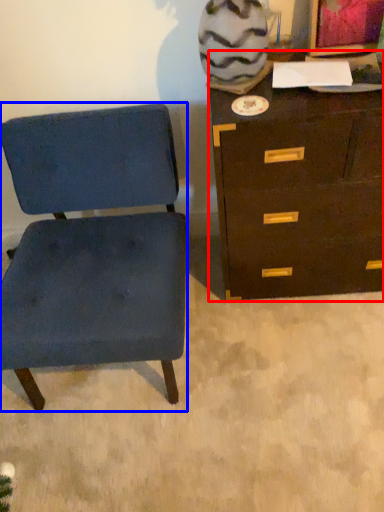
Question: Which of the following is the farthest to the observer, chest of drawers (highlighted by a red box) or chair (highlighted by a blue box)?

Choices:
 (A) chest of drawers
 (B) chair

Answer: (A)